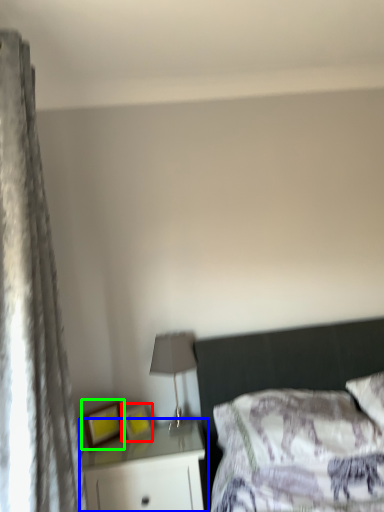
Question: Which object is the farthest from picture frame (highlighted by a red box)? Choose among these: nightstand (highlighted by a blue box) or picture frame (highlighted by a green box).

Choices:
 (A) nightstand
 (B) picture frame

Answer: (A)